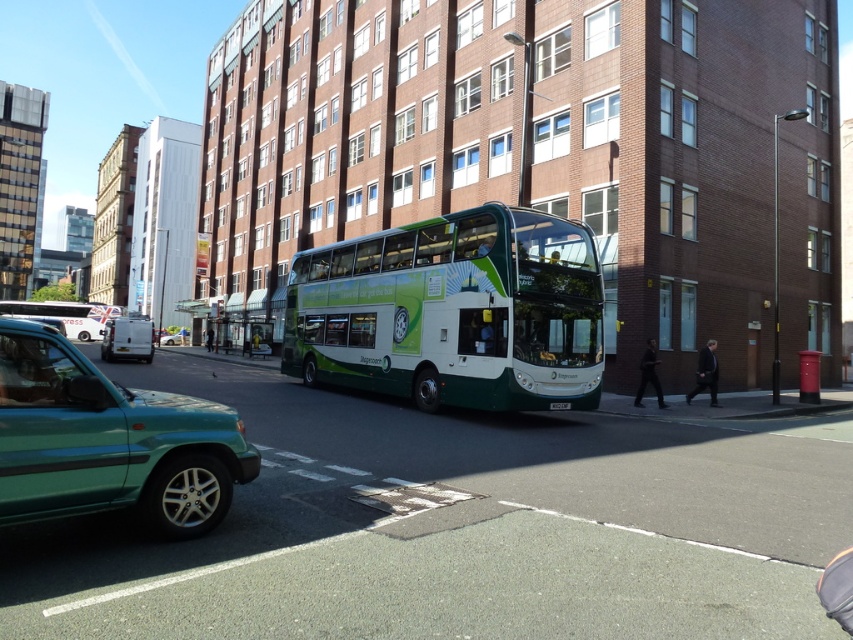
Question: Is white matte van at left closer to the viewer compared to white plastic license plate at center?

Choices:
 (A) yes
 (B) no

Answer: (B)

Question: Among these points, which one is nearest to the camera?

Choices:
 (A) (120, 321)
 (B) (36, 397)
 (C) (556, 275)

Answer: (B)

Question: Which object appears closest to the camera in this image?

Choices:
 (A) white metallic van at left
 (B) white plastic license plate at center
 (C) green matte car at lower left
 (D) white matte van at left

Answer: (C)

Question: Does green matte car at lower left lie behind white plastic license plate at center?

Choices:
 (A) no
 (B) yes

Answer: (A)

Question: Based on their relative distances, which object is farther from the green matte/deck bus at center?

Choices:
 (A) white metallic van at left
 (B) white matte van at left

Answer: (A)

Question: Is green matte car at lower left positioned before white matte van at left?

Choices:
 (A) no
 (B) yes

Answer: (B)